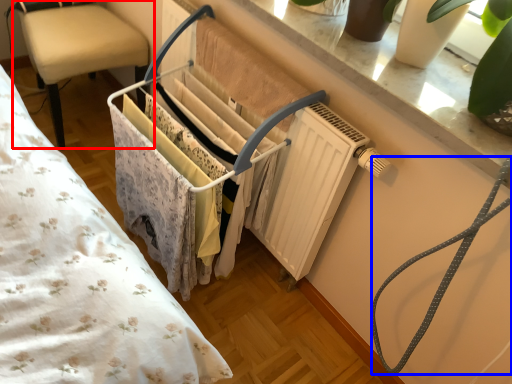
Question: Among these objects, which one is nearest to the camera, chair (highlighted by a red box) or twin (highlighted by a blue box)?

Choices:
 (A) chair
 (B) twin

Answer: (B)